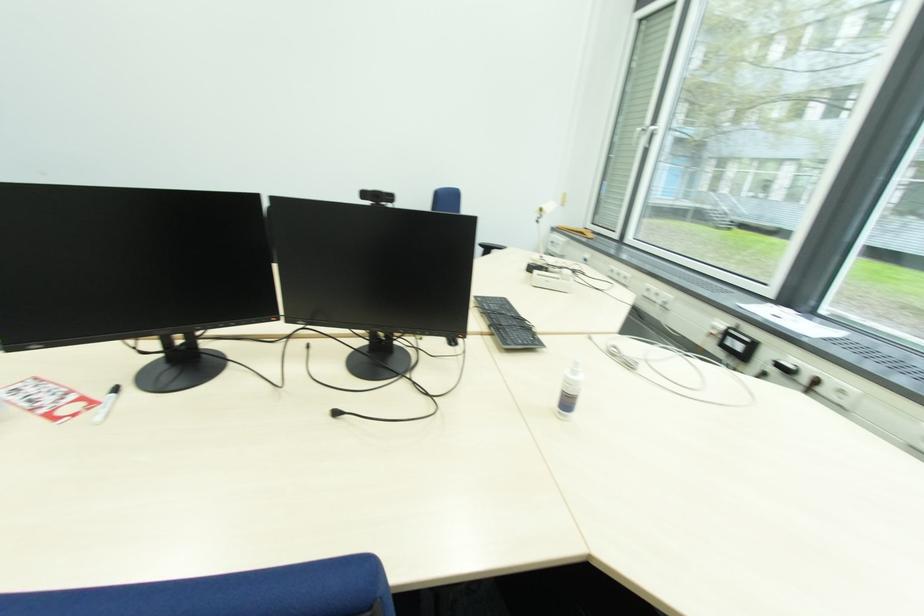
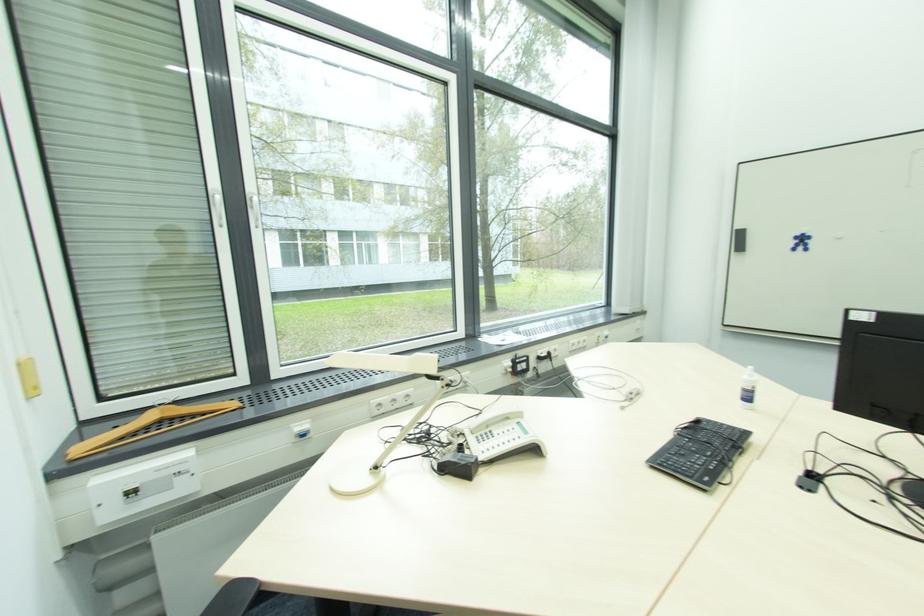
Find the pixel in the second image that matches (599,235) in the first image.

(179, 406)